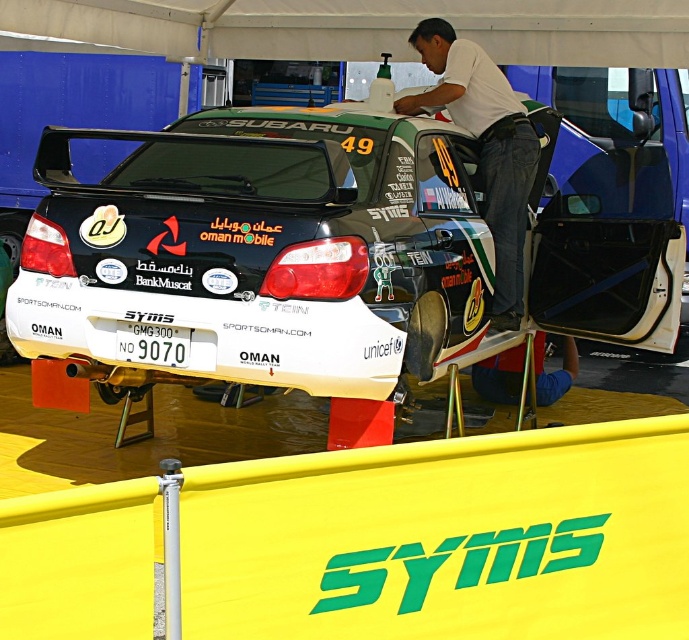
Question: Which point is closer to the camera?

Choices:
 (A) white cotton shirt at upper center
 (B) white plastic license plate at center

Answer: (B)

Question: Is the position of white glossy rally car at center more distant than that of white cotton shirt at upper center?

Choices:
 (A) yes
 (B) no

Answer: (B)

Question: Which point appears closest to the camera in this image?

Choices:
 (A) click(x=380, y=147)
 (B) click(x=522, y=246)

Answer: (A)

Question: Observing the image, what is the correct spatial positioning of white glossy rally car at center in reference to white cotton shirt at upper center?

Choices:
 (A) above
 (B) below

Answer: (B)

Question: Does white glossy rally car at center have a lesser width compared to white plastic license plate at center?

Choices:
 (A) yes
 (B) no

Answer: (B)

Question: Which object is the closest to the white plastic license plate at center?

Choices:
 (A) white glossy rally car at center
 (B) white cotton shirt at upper center

Answer: (A)